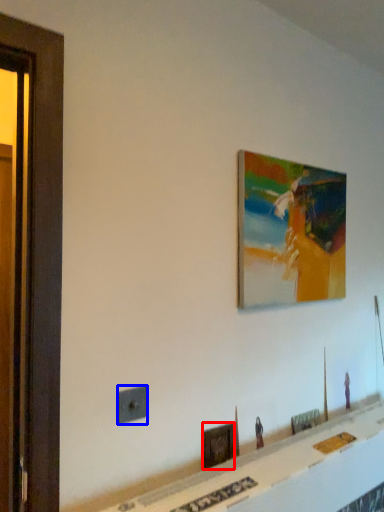
Question: Which object is closer to the camera taking this photo, picture frame (highlighted by a red box) or electric outlet (highlighted by a blue box)?

Choices:
 (A) picture frame
 (B) electric outlet

Answer: (B)